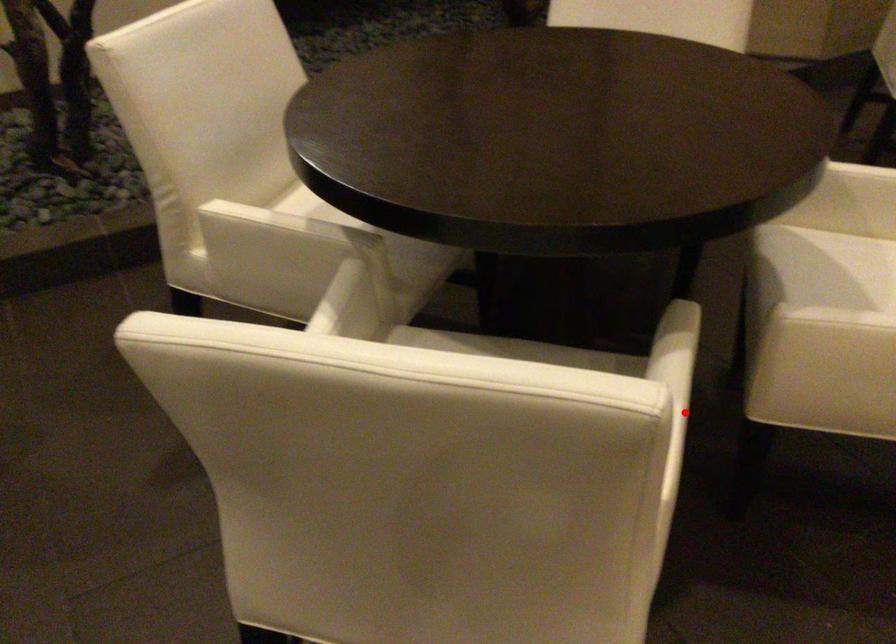
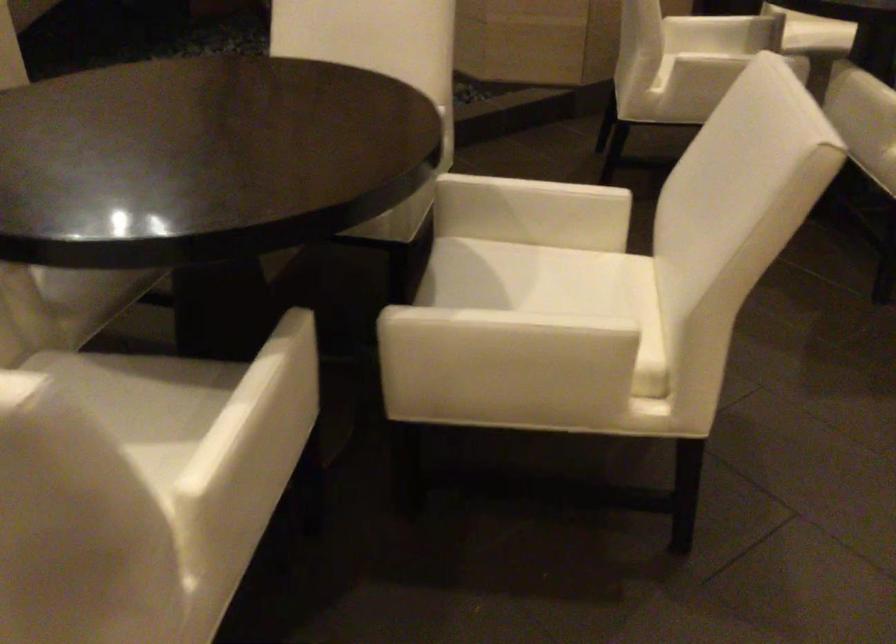
Question: I am providing you with two images of the same scene from different viewpoints. Given a red point in image1, look at the same physical point in image2. Is it:

Choices:
 (A) Closer to the viewpoint
 (B) Farther from the viewpoint

Answer: (B)